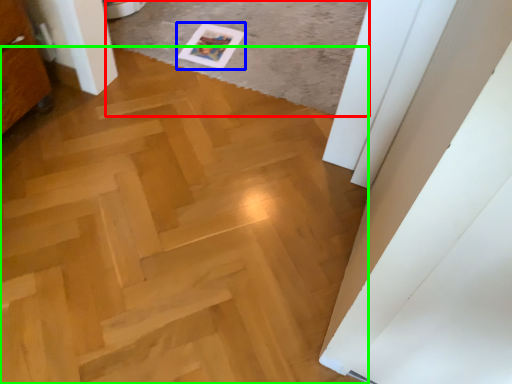
Question: Based on their relative distances, which object is farther from plain (highlighted by a red box)? Choose from postcard (highlighted by a blue box) and plywood (highlighted by a green box).

Choices:
 (A) postcard
 (B) plywood

Answer: (B)